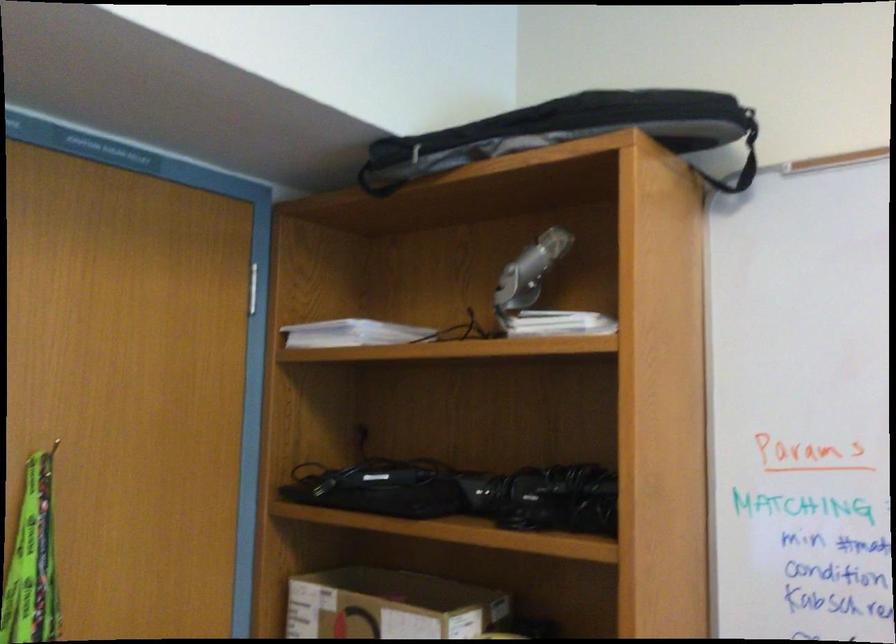
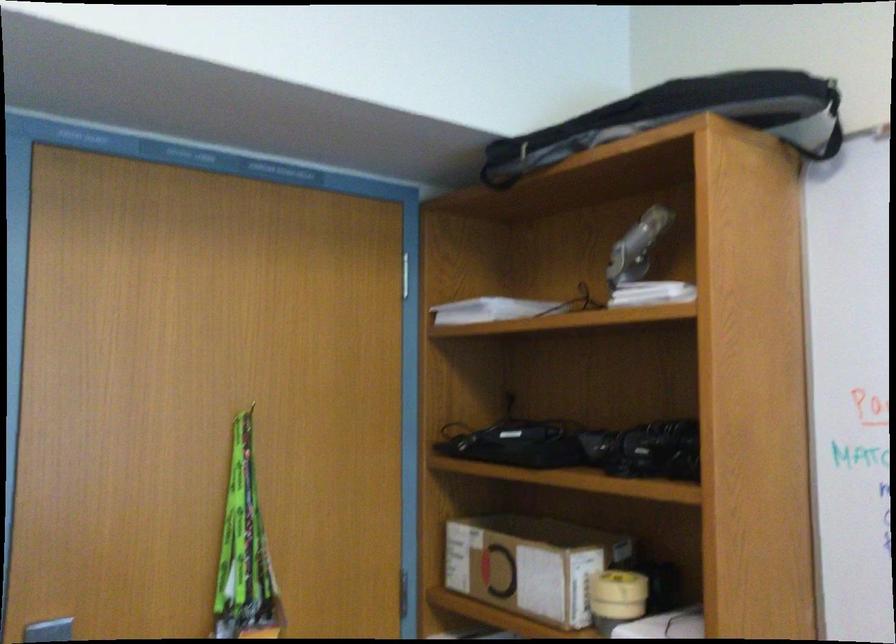
Which direction would the cameraman need to move to produce the second image?

The cameraman walked toward right, backward.